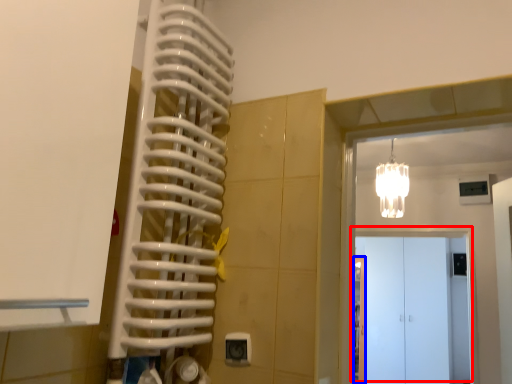
Question: Which of the following is the farthest to the observer, door (highlighted by a red box) or door (highlighted by a blue box)?

Choices:
 (A) door
 (B) door

Answer: (B)